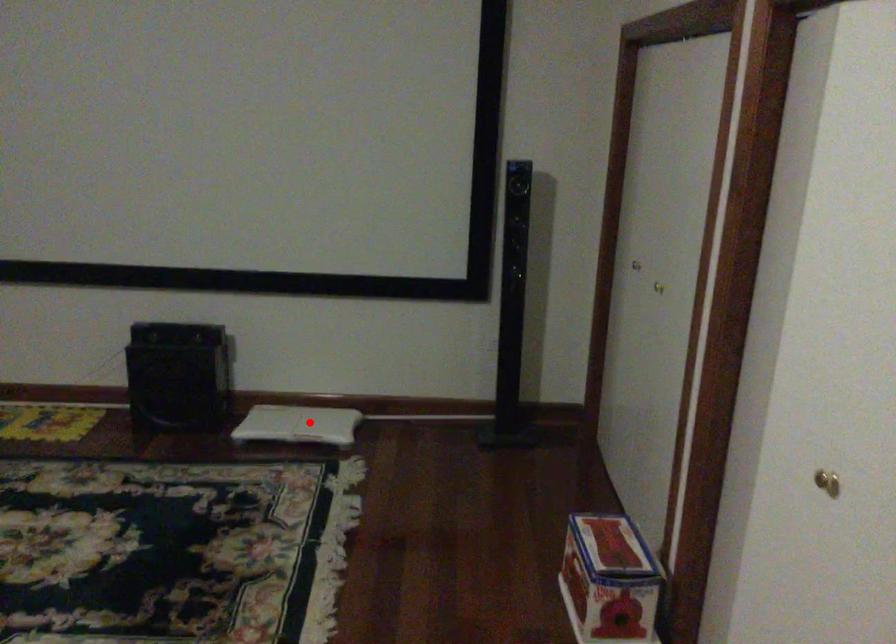
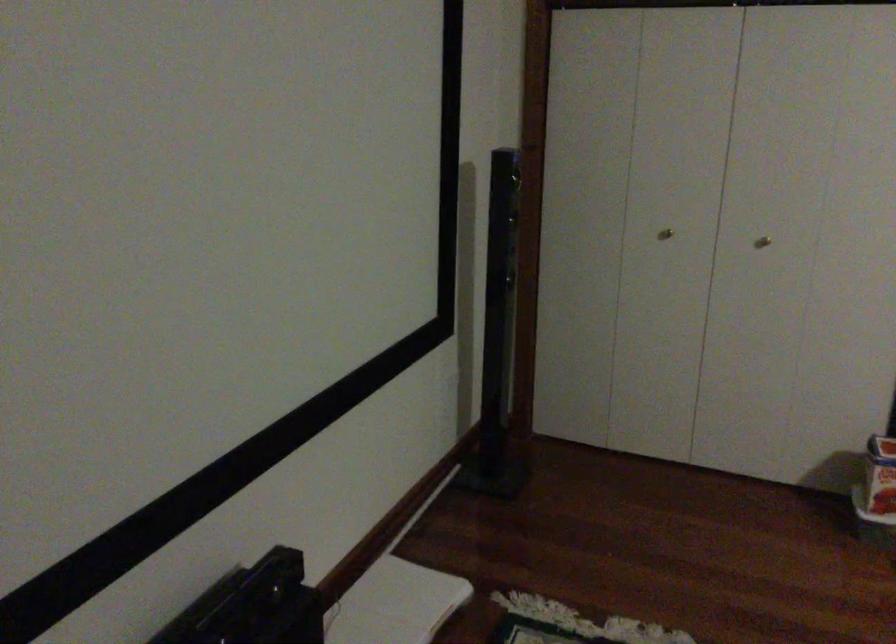
Question: I am providing you with two images of the same scene from different viewpoints. Image1 has a red point marked. In image2, the corresponding 3D location appears at what relative position? Reply with the corresponding letter.

Choices:
 (A) Closer
 (B) Farther

Answer: (A)